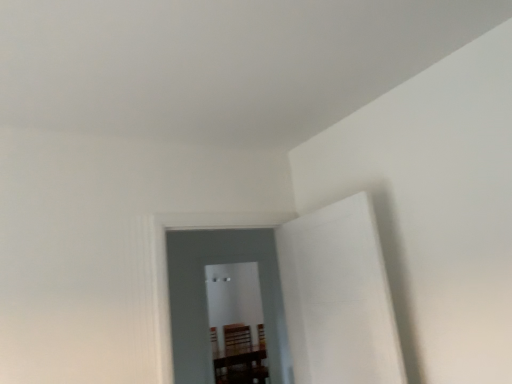
In order to face transparent glass door at center, marked as the 2th glass door in a front-to-back arrangement, should I rotate leftwards or rightwards?

To align with it, rotate left about 1.851°.

Describe the element at coordinates (234, 298) in the screenshot. I see `transparent glass door at center, marked as the 2th glass door in a front-to-back arrangement` at that location.

Find the location of `transparent glass door at center, which is counted as the first glass door, starting from the back`. transparent glass door at center, which is counted as the first glass door, starting from the back is located at coordinates (234, 298).

What do you see at coordinates (206, 297) in the screenshot? I see `transparent glass door at center, placed as the second glass door when sorted from back to front` at bounding box center [206, 297].

This screenshot has height=384, width=512. I want to click on transparent glass door at center, the first glass door positioned from the front, so click(206, 297).

Locate an element on the screen. The image size is (512, 384). transparent glass door at center, which is counted as the first glass door, starting from the back is located at coordinates (234, 298).

Is transparent glass door at center, the first glass door positioned from the front, to the left of transparent glass door at center, marked as the 2th glass door in a front-to-back arrangement, from the viewer's perspective?

In fact, transparent glass door at center, the first glass door positioned from the front, is to the right of transparent glass door at center, marked as the 2th glass door in a front-to-back arrangement.

In the image, is transparent glass door at center, the first glass door positioned from the front, positioned in front of or behind transparent glass door at center, which is counted as the first glass door, starting from the back?

Clearly, transparent glass door at center, the first glass door positioned from the front, is in front of transparent glass door at center, which is counted as the first glass door, starting from the back.

Which is closer, (187,244) or (247,273)?

The point (187,244) is closer to the camera.

From the image's perspective, which object appears higher, transparent glass door at center, the first glass door positioned from the front, or transparent glass door at center, marked as the 2th glass door in a front-to-back arrangement?

transparent glass door at center, the first glass door positioned from the front, from the image's perspective.

From a real-world perspective, relative to transparent glass door at center, marked as the 2th glass door in a front-to-back arrangement, is transparent glass door at center, the first glass door positioned from the front, vertically above or below?

From a real-world perspective, transparent glass door at center, the first glass door positioned from the front, is physically above transparent glass door at center, marked as the 2th glass door in a front-to-back arrangement.

Consider the image. Considering the sizes of objects transparent glass door at center, placed as the second glass door when sorted from back to front, and transparent glass door at center, marked as the 2th glass door in a front-to-back arrangement, in the image provided, who is thinner, transparent glass door at center, placed as the second glass door when sorted from back to front, or transparent glass door at center, marked as the 2th glass door in a front-to-back arrangement,?

transparent glass door at center, placed as the second glass door when sorted from back to front.

Is transparent glass door at center, the first glass door positioned from the front, shorter than transparent glass door at center, which is counted as the first glass door, starting from the back?

Yes.

Who is bigger, transparent glass door at center, the first glass door positioned from the front, or transparent glass door at center, marked as the 2th glass door in a front-to-back arrangement?

transparent glass door at center, marked as the 2th glass door in a front-to-back arrangement.

Is transparent glass door at center, which is counted as the first glass door, starting from the back, inside transparent glass door at center, placed as the second glass door when sorted from back to front?

No, transparent glass door at center, placed as the second glass door when sorted from back to front, does not contain transparent glass door at center, which is counted as the first glass door, starting from the back.

Is transparent glass door at center, placed as the second glass door when sorted from back to front, touching transparent glass door at center, marked as the 2th glass door in a front-to-back arrangement?

No, transparent glass door at center, placed as the second glass door when sorted from back to front, is not next to transparent glass door at center, marked as the 2th glass door in a front-to-back arrangement.

Is transparent glass door at center, the first glass door positioned from the front, positioned with its back to transparent glass door at center, marked as the 2th glass door in a front-to-back arrangement?

Yes, transparent glass door at center, the first glass door positioned from the front,'s orientation is away from transparent glass door at center, marked as the 2th glass door in a front-to-back arrangement.

Can you tell me how much transparent glass door at center, placed as the second glass door when sorted from back to front, and transparent glass door at center, marked as the 2th glass door in a front-to-back arrangement, differ in facing direction?

There is a 2.58e-05-degree angle between the facing directions of transparent glass door at center, placed as the second glass door when sorted from back to front, and transparent glass door at center, marked as the 2th glass door in a front-to-back arrangement.

Where is `glass door that is on the right side of transparent glass door at center, marked as the 2th glass door in a front-to-back arrangement`? This screenshot has width=512, height=384. glass door that is on the right side of transparent glass door at center, marked as the 2th glass door in a front-to-back arrangement is located at coordinates (206, 297).

From the picture: Which is more to the left, transparent glass door at center, marked as the 2th glass door in a front-to-back arrangement, or transparent glass door at center, placed as the second glass door when sorted from back to front?

transparent glass door at center, marked as the 2th glass door in a front-to-back arrangement.

Is transparent glass door at center, marked as the 2th glass door in a front-to-back arrangement, closer to the viewer compared to transparent glass door at center, the first glass door positioned from the front?

No, transparent glass door at center, marked as the 2th glass door in a front-to-back arrangement, is further to the viewer.

Is point (238, 305) closer or farther from the camera than point (274, 239)?

Clearly, point (238, 305) is more distant from the camera than point (274, 239).

From the image's perspective, who appears lower, transparent glass door at center, marked as the 2th glass door in a front-to-back arrangement, or transparent glass door at center, the first glass door positioned from the front?

transparent glass door at center, marked as the 2th glass door in a front-to-back arrangement, from the image's perspective.

From a real-world perspective, is transparent glass door at center, which is counted as the first glass door, starting from the back, on top of transparent glass door at center, the first glass door positioned from the front?

No, from a real-world perspective, transparent glass door at center, which is counted as the first glass door, starting from the back, is not above transparent glass door at center, the first glass door positioned from the front.

Considering the relative sizes of transparent glass door at center, marked as the 2th glass door in a front-to-back arrangement, and transparent glass door at center, the first glass door positioned from the front, in the image provided, is transparent glass door at center, marked as the 2th glass door in a front-to-back arrangement, thinner than transparent glass door at center, the first glass door positioned from the front,?

In fact, transparent glass door at center, marked as the 2th glass door in a front-to-back arrangement, might be wider than transparent glass door at center, the first glass door positioned from the front.

Between transparent glass door at center, marked as the 2th glass door in a front-to-back arrangement, and transparent glass door at center, the first glass door positioned from the front, which one has more height?

transparent glass door at center, marked as the 2th glass door in a front-to-back arrangement.

Is transparent glass door at center, marked as the 2th glass door in a front-to-back arrangement, bigger or smaller than transparent glass door at center, the first glass door positioned from the front?

In the image, transparent glass door at center, marked as the 2th glass door in a front-to-back arrangement, appears to be larger than transparent glass door at center, the first glass door positioned from the front.

Do you think transparent glass door at center, marked as the 2th glass door in a front-to-back arrangement, is within transparent glass door at center, the first glass door positioned from the front, or outside of it?

The correct answer is: outside.

Can you see transparent glass door at center, marked as the 2th glass door in a front-to-back arrangement, touching transparent glass door at center, placed as the second glass door when sorted from back to front?

They are not placed beside each other.

Is transparent glass door at center, marked as the 2th glass door in a front-to-back arrangement, turned away from transparent glass door at center, placed as the second glass door when sorted from back to front?

No, transparent glass door at center, marked as the 2th glass door in a front-to-back arrangement, is not facing the opposite direction of transparent glass door at center, placed as the second glass door when sorted from back to front.

Could you measure the distance between transparent glass door at center, marked as the 2th glass door in a front-to-back arrangement, and transparent glass door at center, the first glass door positioned from the front?

transparent glass door at center, marked as the 2th glass door in a front-to-back arrangement, and transparent glass door at center, the first glass door positioned from the front, are 9.69 feet apart.

You are a GUI agent. You are given a task and a screenshot of the screen. Output one action in this format:
    pyautogui.click(x=<x>, y=<y>)
    Task: Click on the glass door on the left side of transparent glass door at center, placed as the second glass door when sorted from back to front
    This screenshot has width=512, height=384.
    Given the screenshot: What is the action you would take?
    [234, 298]

Where is `glass door lying behind the transparent glass door at center, placed as the second glass door when sorted from back to front`? The height and width of the screenshot is (384, 512). glass door lying behind the transparent glass door at center, placed as the second glass door when sorted from back to front is located at coordinates (234, 298).

You are a GUI agent. You are given a task and a screenshot of the screen. Output one action in this format:
    pyautogui.click(x=<x>, y=<y>)
    Task: Click on the glass door on the right of transparent glass door at center, which is counted as the first glass door, starting from the back
    
    Given the screenshot: What is the action you would take?
    pyautogui.click(x=206, y=297)